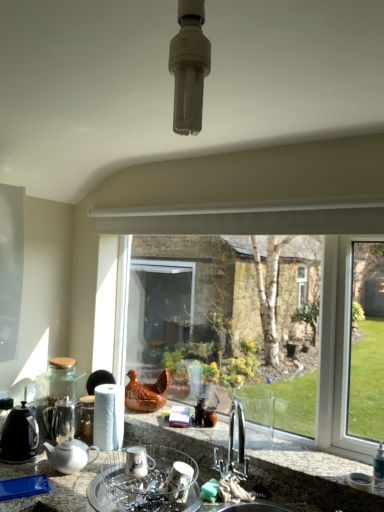
Question: Is clear glass window at center wider than white glossy teapot at lower left, which is the 1th kitchen appliance from right to left?

Choices:
 (A) yes
 (B) no

Answer: (A)

Question: Is white glossy teapot at lower left, the second kitchen appliance positioned from the left, surrounded by clear glass window at center?

Choices:
 (A) no
 (B) yes

Answer: (A)

Question: Does clear glass window at center come behind white glossy teapot at lower left, which is the 1th kitchen appliance from right to left?

Choices:
 (A) yes
 (B) no

Answer: (B)

Question: Can you see clear glass window at center touching white glossy teapot at lower left, the second kitchen appliance positioned from the left?

Choices:
 (A) yes
 (B) no

Answer: (B)

Question: Does clear glass window at center have a larger size compared to white glossy teapot at lower left, the second kitchen appliance positioned from the left?

Choices:
 (A) yes
 (B) no

Answer: (A)

Question: Does clear glass window at center have a greater height compared to white glossy teapot at lower left, which is the 1th kitchen appliance from right to left?

Choices:
 (A) yes
 (B) no

Answer: (A)

Question: Would you consider black matte kettle at left, positioned as the 2th kitchen appliance in right-to-left order, to be distant from clear glass window at center?

Choices:
 (A) no
 (B) yes

Answer: (A)

Question: Considering the relative sizes of black matte kettle at left, positioned as the 2th kitchen appliance in right-to-left order, and clear glass window at center in the image provided, is black matte kettle at left, positioned as the 2th kitchen appliance in right-to-left order, bigger than clear glass window at center?

Choices:
 (A) yes
 (B) no

Answer: (B)

Question: Is black matte kettle at left, which is the 1th kitchen appliance from left to right, wider than clear glass window at center?

Choices:
 (A) yes
 (B) no

Answer: (A)

Question: Are black matte kettle at left, which is the 1th kitchen appliance from left to right, and clear glass window at center making contact?

Choices:
 (A) no
 (B) yes

Answer: (A)

Question: From the image's perspective, is black matte kettle at left, positioned as the 2th kitchen appliance in right-to-left order, beneath clear glass window at center?

Choices:
 (A) yes
 (B) no

Answer: (A)

Question: Is black matte kettle at left, which is the 1th kitchen appliance from left to right, to the right of clear glass window at center from the viewer's perspective?

Choices:
 (A) no
 (B) yes

Answer: (A)

Question: Does clear glass window at center have a lesser width compared to porcelain dish rack at center, arranged as the first appliance when viewed from the front?

Choices:
 (A) no
 (B) yes

Answer: (B)